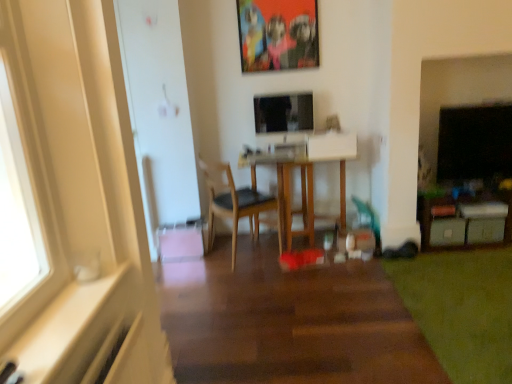
Find the location of a particular element. Image resolution: width=512 pixels, height=384 pixels. free location in front of wooden chair at center is located at coordinates (243, 279).